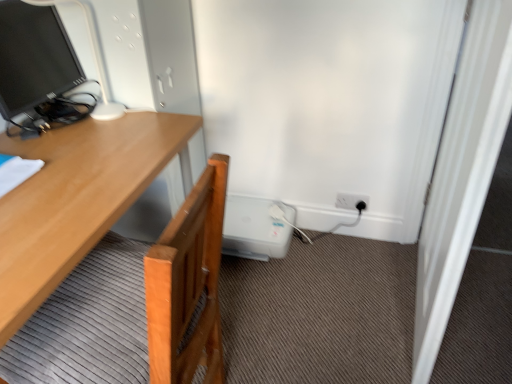
At what (x,y) coordinates should I click in order to perform the action: click on free location to the right of matte black monitor at upper left. Please return your answer as a coordinate pair (x, y). The height and width of the screenshot is (384, 512). Looking at the image, I should click on (137, 134).